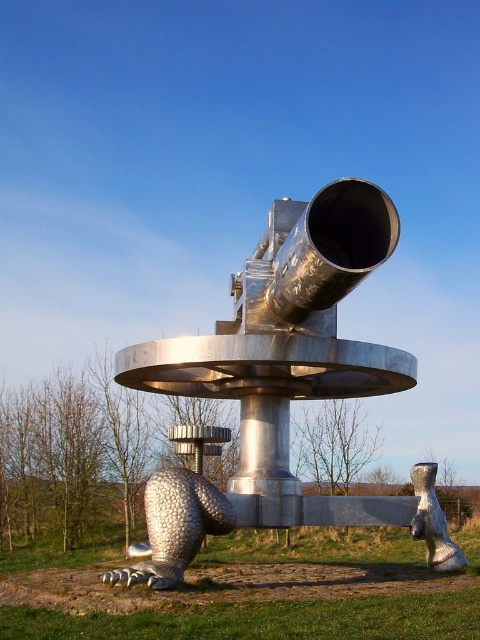
Does metallic silver telescope at center appear under silver textured bear at lower left?

No, metallic silver telescope at center is not below silver textured bear at lower left.

Who is lower down, metallic silver telescope at center or silver textured bear at lower left?

silver textured bear at lower left is below.

What are the coordinates of `metallic silver telescope at center` in the screenshot? It's located at (282, 385).